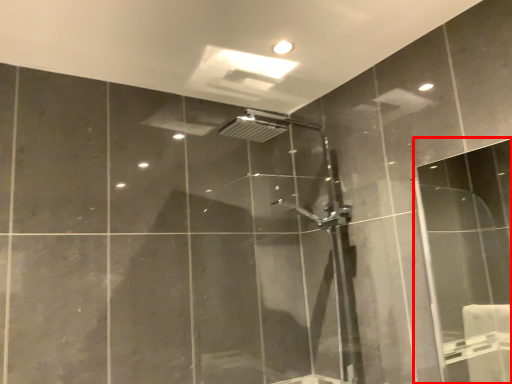
Question: Observing the image, what is the correct spatial positioning of screen door (annotated by the red box) in reference to shower door?

Choices:
 (A) right
 (B) left

Answer: (A)